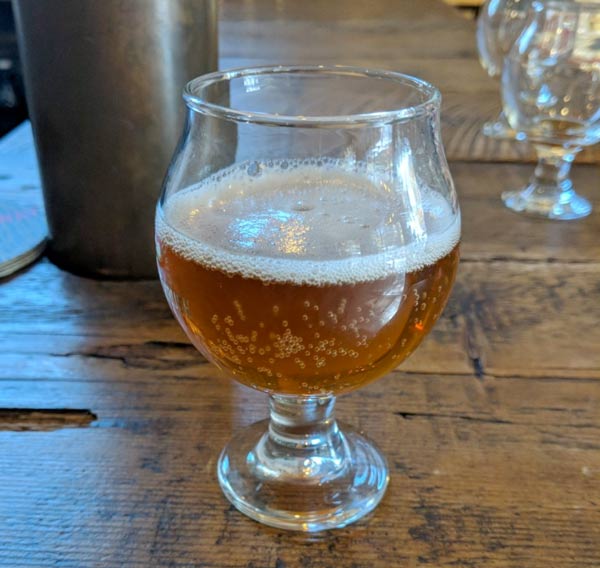
This screenshot has height=568, width=600. I want to click on wooden surface, so click(153, 404).